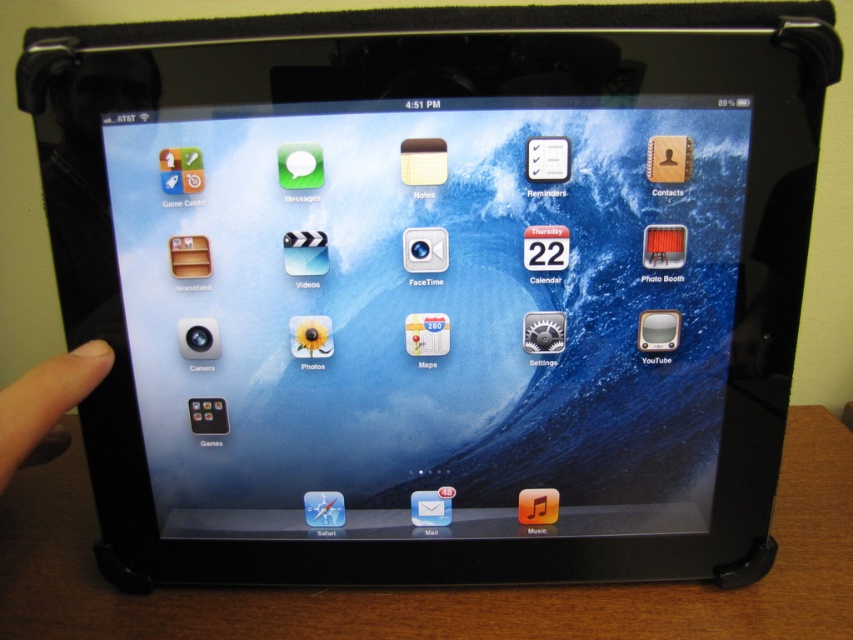
You are holding a smartphone and looking at the brown wooden table at bottom and the skinsmoothhand at left in the image. Which object is bigger?

The brown wooden table at bottom is larger in size than skinsmoothhand at left.

You are looking at the iPad screen and want to place your finger at the point labeled point (437, 588). Based on the scene description, what real object will your finger be touching when you tap that point on the screen?

The point (437, 588) corresponds to the brown wooden table at bottom, so tapping that point on the iPad screen will touch the brown wooden table at bottom.

From the picture: You are holding a tablet and looking at the brown wooden table at bottom and the skinsmoothhand at left. Which object is positioned to the right side?

The brown wooden table at bottom is to the right of skinsmoothhand at left.